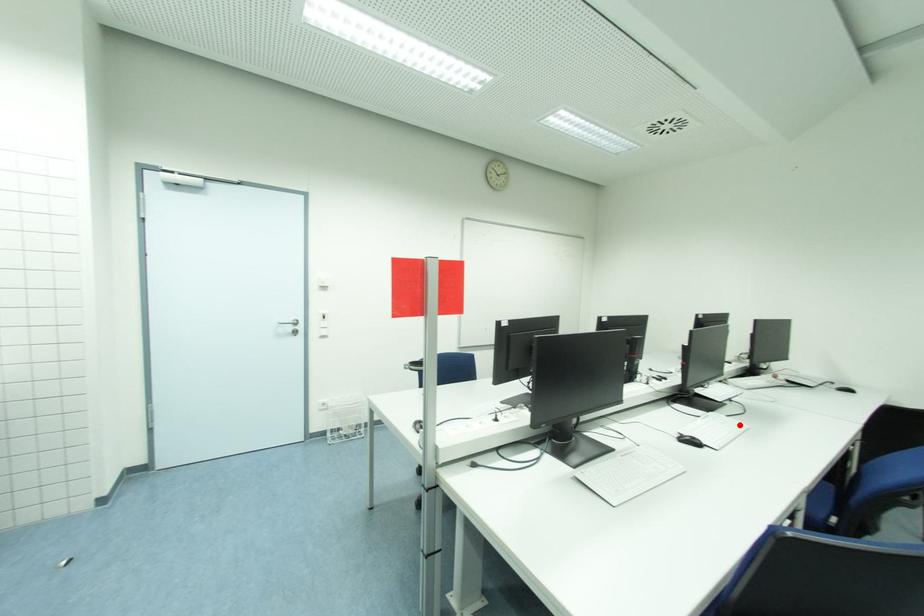
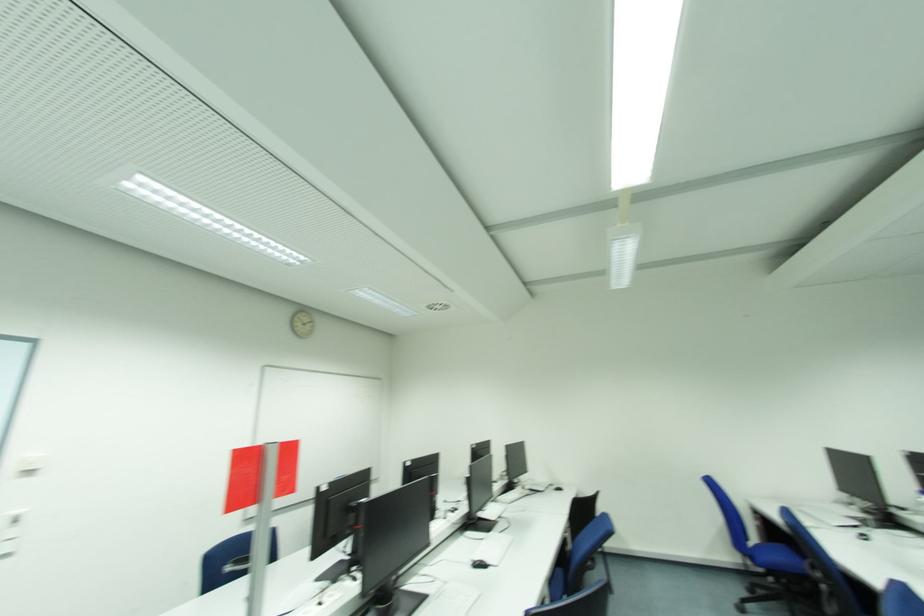
Find the pixel in the second image that matches the highlighted location in the first image.

(508, 540)